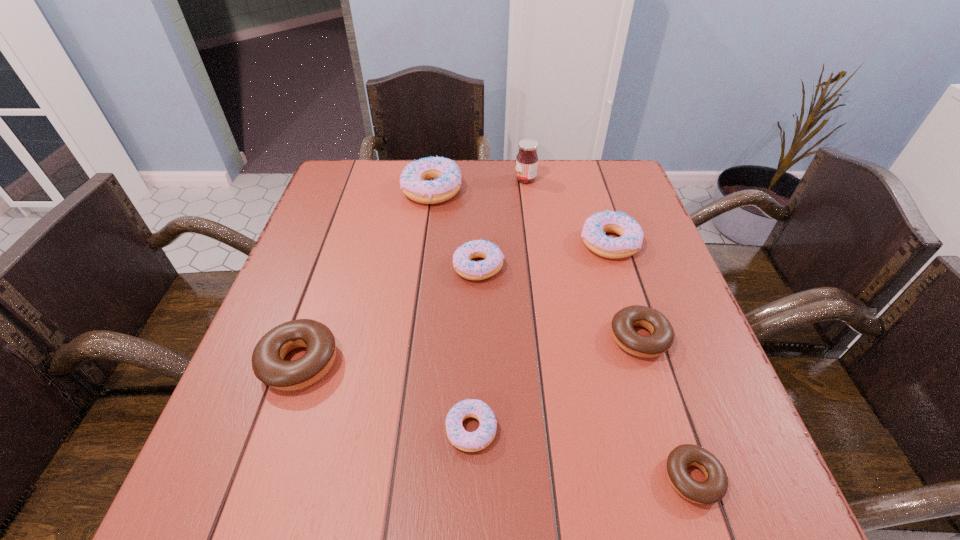
Where is `vacant space situated 0.300m on the back of the smallest brown doughnut`? The height and width of the screenshot is (540, 960). vacant space situated 0.300m on the back of the smallest brown doughnut is located at coordinates (637, 311).

You are a GUI agent. You are given a task and a screenshot of the screen. Output one action in this format:
    pyautogui.click(x=<x>, y=<y>)
    Task: Click on the jam that is at the far edge
    This screenshot has width=960, height=540.
    Given the screenshot: What is the action you would take?
    pyautogui.click(x=527, y=159)

Identify the location of doughnut positioned at the far edge. The height and width of the screenshot is (540, 960). (445, 173).

Find the location of a particular element. The height and width of the screenshot is (540, 960). object at the near edge is located at coordinates (714, 488).

I want to click on object that is at the left edge, so click(x=268, y=364).

At what (x,y) coordinates should I click in order to perform the action: click on object located at the near right corner. Please return your answer as a coordinate pair (x, y). Looking at the image, I should click on (714, 488).

The image size is (960, 540). Identify the location of free spot at the far edge of the desktop. (573, 188).

I want to click on vacant region at the near edge, so click(x=656, y=518).

Where is `blank space at the left edge of the desktop`? The width and height of the screenshot is (960, 540). blank space at the left edge of the desktop is located at coordinates (356, 251).

In order to click on vacant space at the right edge of the desktop in this screenshot , I will do `click(643, 362)`.